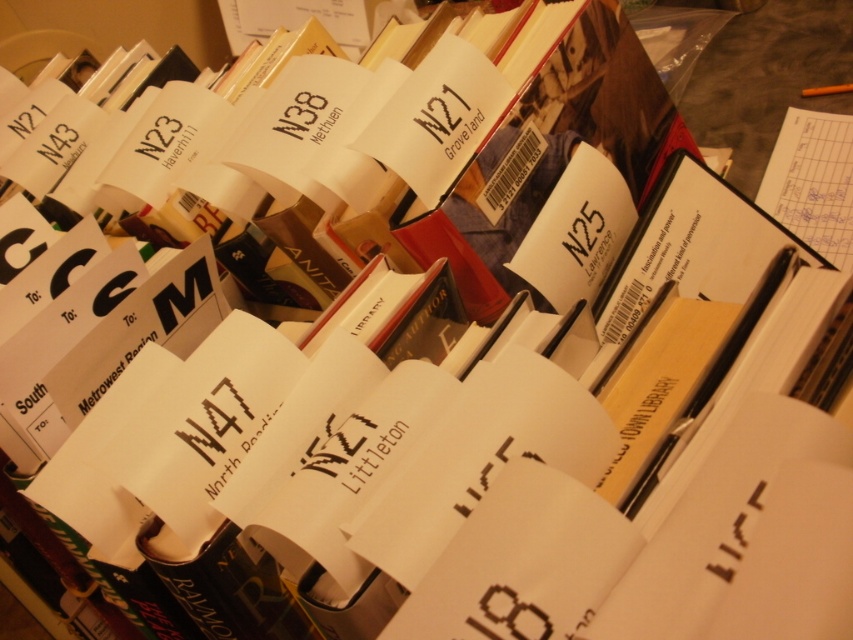
What is the relationship between the width of the yellow paper at right and the black paper at center?

The yellow paper at right is wider than the black paper at center.